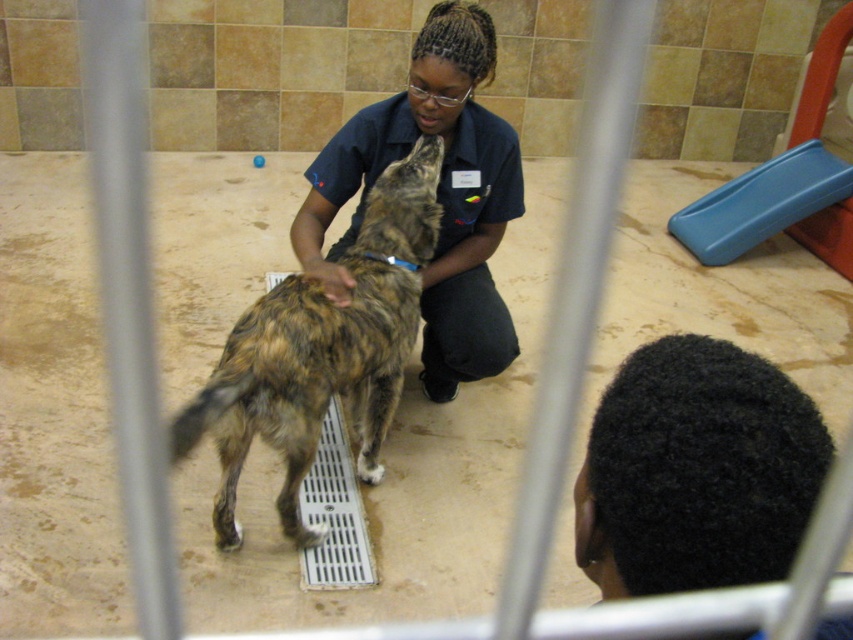
You are a visitor at the pet care facility and want to know the relative sizes of the brown fur dog at center and the dark blue uniform at center. Which one is wider?

The brown fur dog at center is less wide than the dark blue uniform at center, so the dark blue uniform at center is wider.